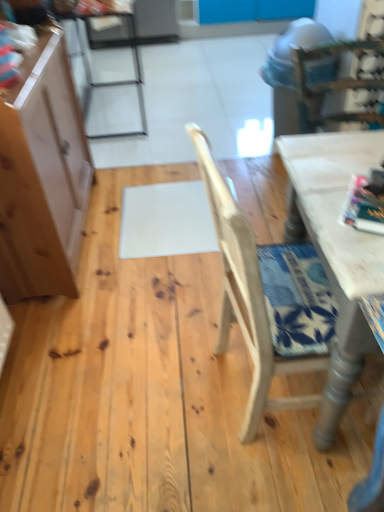
Question: Is white painted wood table at right wider or thinner than metallic silver chair at upper left, the 2th chair when ordered from front to back?

Choices:
 (A) wide
 (B) thin

Answer: (A)

Question: Is white painted wood table at right taller or shorter than metallic silver chair at upper left, the 1th chair in the left-to-right sequence?

Choices:
 (A) tall
 (B) short

Answer: (B)

Question: Based on their relative distances, which object is farther from the white matte table at upper right?

Choices:
 (A) light brown wood cabinet at left
 (B) metallic silver chair at upper left, which is the second chair from bottom to top
 (C) white painted wood table at right
 (D) light brown wood chair at center, the first chair viewed from the right

Answer: (B)

Question: Estimate the real-world distances between objects in this image. Which object is closer to the light brown wood chair at center, placed as the 1th chair when sorted from front to back?

Choices:
 (A) white matte table at upper right
 (B) light brown wood cabinet at left
 (C) metallic silver chair at upper left, positioned as the first chair in top-to-bottom order
 (D) white painted wood table at right

Answer: (D)